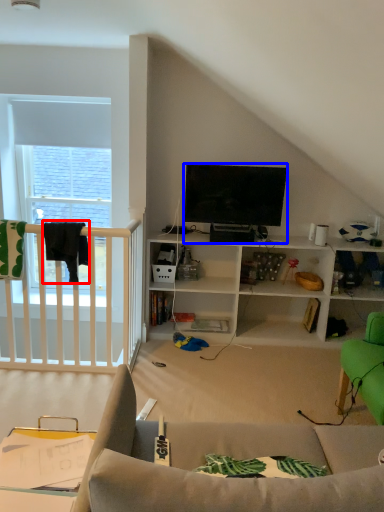
Question: Which object appears closest to the camera in this image, clothesline (highlighted by a red box) or television (highlighted by a blue box)?

Choices:
 (A) clothesline
 (B) television

Answer: (A)